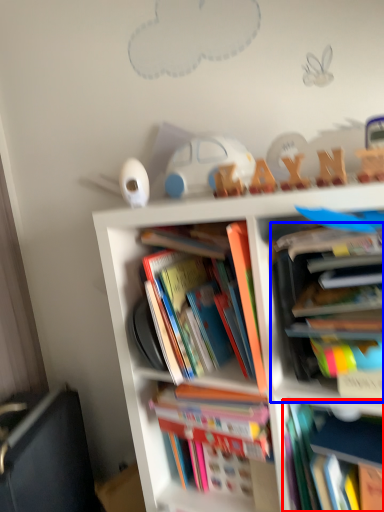
Question: Which object is further to the camera taking this photo, book (highlighted by a red box) or book (highlighted by a blue box)?

Choices:
 (A) book
 (B) book

Answer: (A)